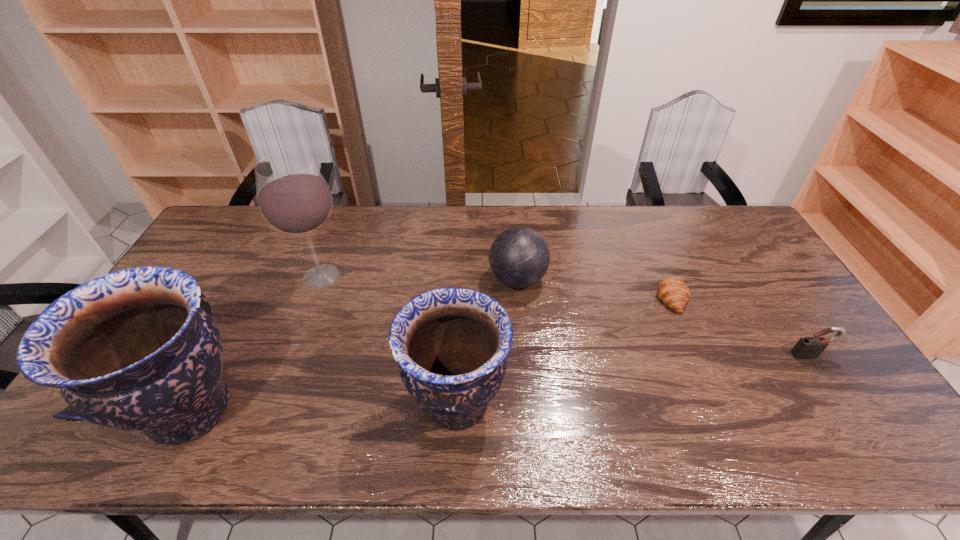
Locate an element on the screen. The image size is (960, 540). the left pottery is located at coordinates (136, 349).

Identify the location of the fifth shortest object. The width and height of the screenshot is (960, 540). (136, 349).

Find the location of a particular element. This screenshot has height=540, width=960. the shorter pottery is located at coordinates (451, 343).

Locate an element on the screen. The height and width of the screenshot is (540, 960). the right pottery is located at coordinates (451, 343).

Locate an element on the screen. the second object from right to left is located at coordinates (672, 291).

What are the coordinates of `crescent roll` in the screenshot? It's located at (672, 291).

Image resolution: width=960 pixels, height=540 pixels. What are the coordinates of `the fourth tallest object` in the screenshot? It's located at (519, 257).

Where is `the tallest object`? The height and width of the screenshot is (540, 960). the tallest object is located at coordinates (293, 197).

The height and width of the screenshot is (540, 960). In order to click on the rightmost object in this screenshot , I will do `click(807, 347)`.

You are a GUI agent. You are given a task and a screenshot of the screen. Output one action in this format:
    pyautogui.click(x=<x>, y=<y>)
    Task: Click on the padlock
    The width and height of the screenshot is (960, 540).
    Given the screenshot: What is the action you would take?
    pos(807,347)